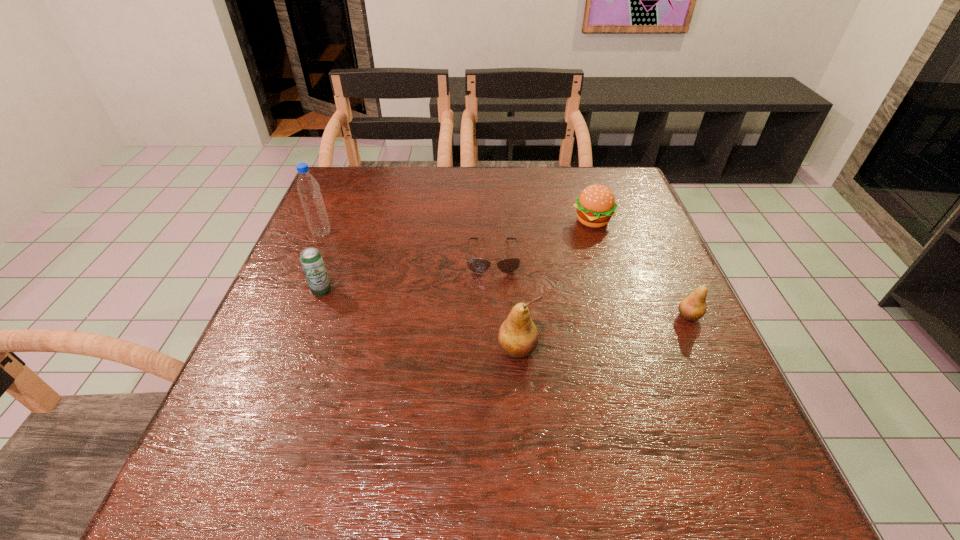
This screenshot has height=540, width=960. What are the coordinates of `hamburger located at the right edge` in the screenshot? It's located at (596, 204).

The image size is (960, 540). Find the location of `object that is positioned at the far right corner`. object that is positioned at the far right corner is located at coordinates (596, 204).

This screenshot has width=960, height=540. In the image, there is a desktop. What are the coordinates of `free space at the far edge` in the screenshot? It's located at 533,173.

Image resolution: width=960 pixels, height=540 pixels. I want to click on free space at the near edge of the desktop, so click(531, 426).

The height and width of the screenshot is (540, 960). Find the location of `blank space at the right edge`. blank space at the right edge is located at coordinates (679, 390).

Locate an element on the screen. The height and width of the screenshot is (540, 960). free space at the far left corner of the desktop is located at coordinates (373, 184).

You are a GUI agent. You are given a task and a screenshot of the screen. Output one action in this format:
    pyautogui.click(x=<x>, y=<y>)
    Task: Click on the blank space at the far right corner of the desktop
    
    Given the screenshot: What is the action you would take?
    tap(575, 168)

The height and width of the screenshot is (540, 960). Find the location of `vacant space at the near right corner`. vacant space at the near right corner is located at coordinates (684, 404).

Where is `free point between the farther pear and the hamburger`? The image size is (960, 540). free point between the farther pear and the hamburger is located at coordinates (640, 268).

Where is `vacant space that is in between the fourth farthest object and the second object from right to left`? This screenshot has height=540, width=960. vacant space that is in between the fourth farthest object and the second object from right to left is located at coordinates (457, 255).